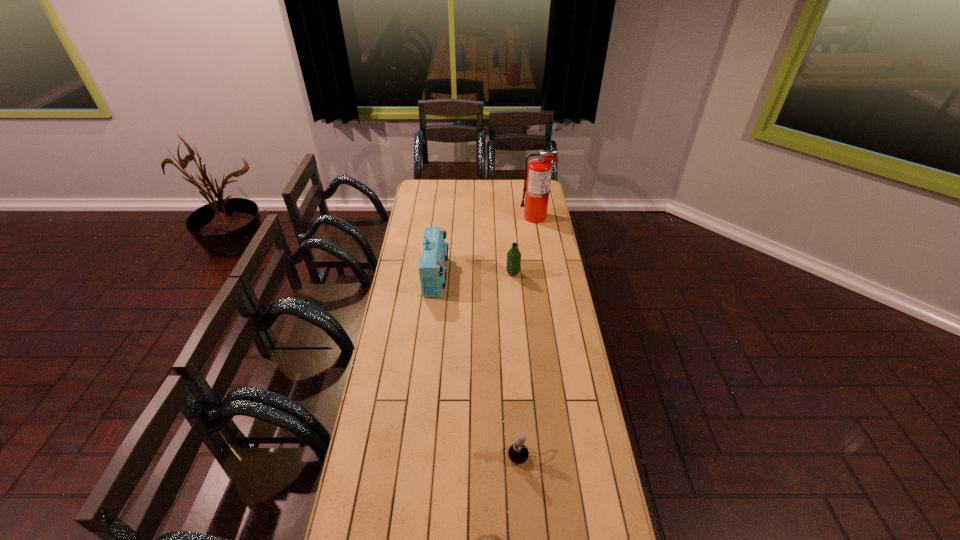
Find the location of a particular element. The image size is (960, 540). free space located on the left of the water bottle is located at coordinates (461, 274).

This screenshot has height=540, width=960. Identify the location of vacant space situated 0.330m on the left of the second shortest object. point(413,457).

What are the coordinates of `object that is at the left edge` in the screenshot? It's located at (432, 270).

Locate an element on the screen. fire extinguisher located in the right edge section of the desktop is located at coordinates (538, 173).

Where is `microphone that is at the right edge`? The height and width of the screenshot is (540, 960). microphone that is at the right edge is located at coordinates (518, 453).

In order to click on vacant space at the far edge in this screenshot , I will do `click(444, 183)`.

At what (x,y) coordinates should I click in order to perform the action: click on free region at the left edge of the desktop. Please return your answer as a coordinate pair (x, y). Looking at the image, I should click on (364, 480).

Where is `vacant space at the right edge`? This screenshot has height=540, width=960. vacant space at the right edge is located at coordinates (561, 375).

In the image, there is a desktop. Where is `vacant space at the far left corner`? vacant space at the far left corner is located at coordinates (413, 194).

At what (x,y) coordinates should I click in order to perform the action: click on free space between the third tallest object and the radio receiver. Please return your answer as a coordinate pair (x, y). Looking at the image, I should click on (474, 275).